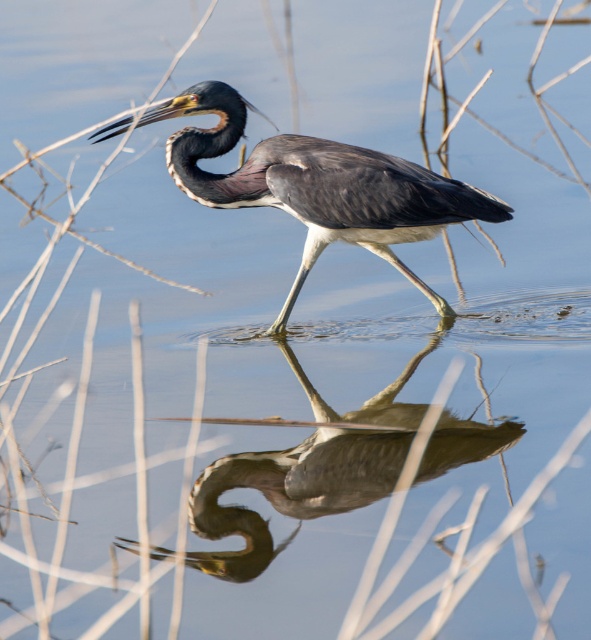
You are a wildlife photographer aiming to capture a closeup shot of the brown feathered heron at center. Your camera has a maximum focus range of 10 feet. Can you take the photo without moving closer?

The brown feathered heron at center is 10.17 feet away from camera. Since the distance exceeds the camera maximum focus range of 10 feet, you cannot take the photo without moving closer.

You are a wildlife photographer trying to capture a clear photo of the brown feathered heron at center and the smooth gray heron at center. Your camera has a minimum focus distance of 38 inches. Can you focus on both birds at the same time?

The brown feathered heron at center is 38.01 inches from smooth gray heron at center. Since the distance between them is slightly over 38 inches, your camera can focus on both birds simultaneously as the distance meets the minimum requirement.